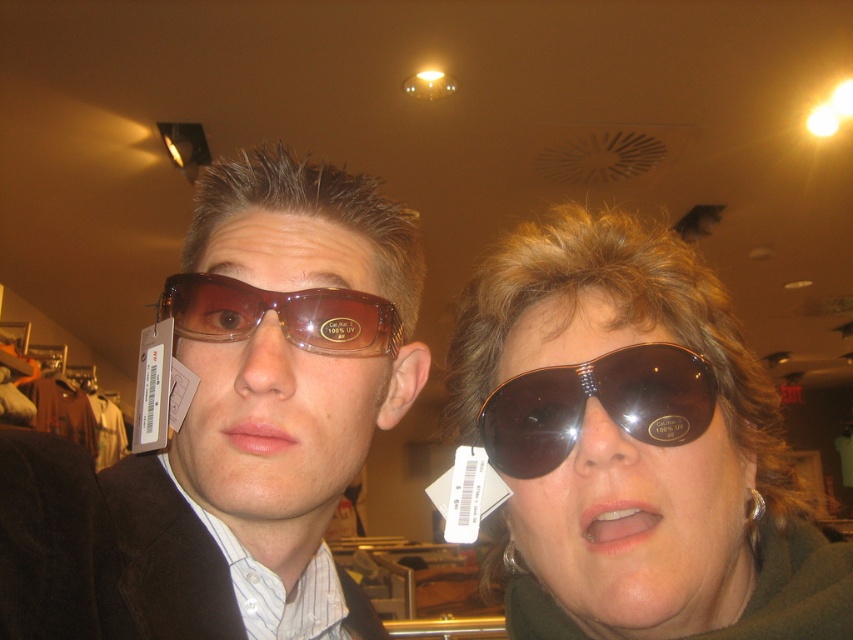
Question: Does brown shiny aviator sunglasses at center appear on the right side of brown matte sunglasses at left?

Choices:
 (A) yes
 (B) no

Answer: (A)

Question: Is the position of brown shiny aviator sunglasses at center less distant than that of brown matte sunglasses at left?

Choices:
 (A) yes
 (B) no

Answer: (A)

Question: Which of these objects is positioned farthest from the brown matte sunglasses at center?

Choices:
 (A) brown matte sunglasses at left
 (B) brown shiny aviator sunglasses at center
 (C) matte brown sunglasses at left

Answer: (A)

Question: Which is farther from the matte brown sunglasses at left?

Choices:
 (A) brown matte sunglasses at center
 (B) brown shiny aviator sunglasses at center

Answer: (B)

Question: Which object is positioned farthest from the brown matte sunglasses at center?

Choices:
 (A) brown matte sunglasses at left
 (B) matte brown sunglasses at left
 (C) brown shiny aviator sunglasses at center

Answer: (A)

Question: Is brown matte sunglasses at center wider than brown matte sunglasses at left?

Choices:
 (A) yes
 (B) no

Answer: (A)